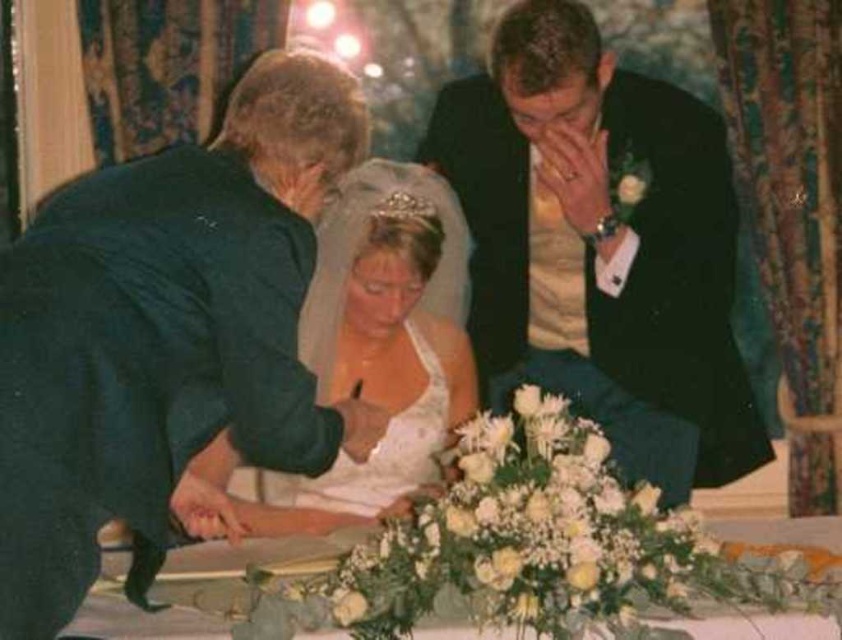
Does black satin suit at upper right have a lesser width compared to white satin dress at center?

No.

Measure the distance between black satin suit at upper right and white satin dress at center.

black satin suit at upper right and white satin dress at center are 33.62 centimeters apart.

Who is more forward, (x=653, y=371) or (x=302, y=529)?

Point (x=302, y=529)

Where is `black satin suit at upper right`? This screenshot has width=842, height=640. black satin suit at upper right is located at coordinates (601, 246).

In the scene shown: Which is more to the left, white satin dress at left or white floral arrangement at center?

Positioned to the left is white satin dress at left.

Can you confirm if white satin dress at left is positioned below white floral arrangement at center?

No, white satin dress at left is not below white floral arrangement at center.

I want to click on white satin dress at left, so click(164, 333).

Does white satin dress at left have a greater height compared to white satin dress at center?

Yes, white satin dress at left is taller than white satin dress at center.

Does white satin dress at left have a greater width compared to white satin dress at center?

In fact, white satin dress at left might be narrower than white satin dress at center.

This screenshot has height=640, width=842. In order to click on white satin dress at left in this screenshot , I will do `click(164, 333)`.